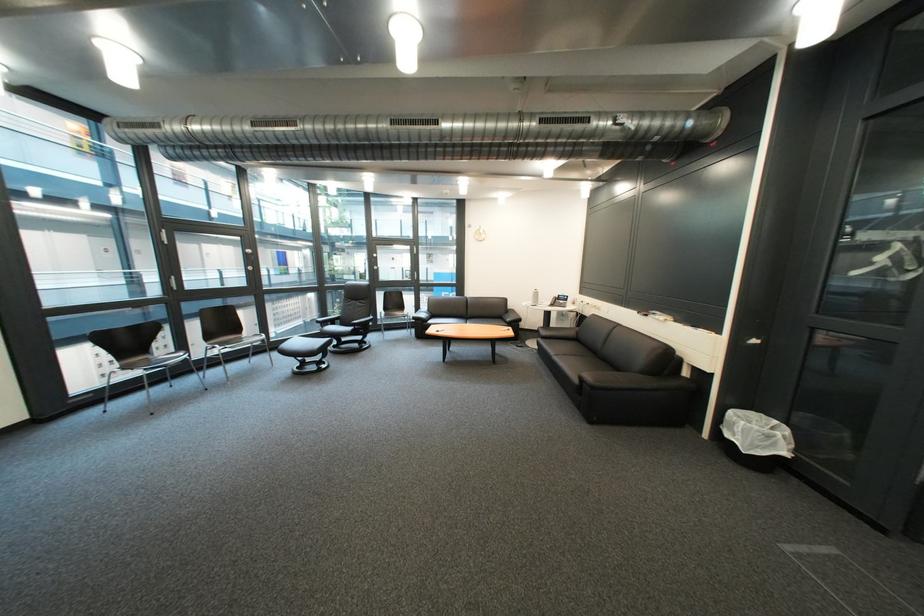
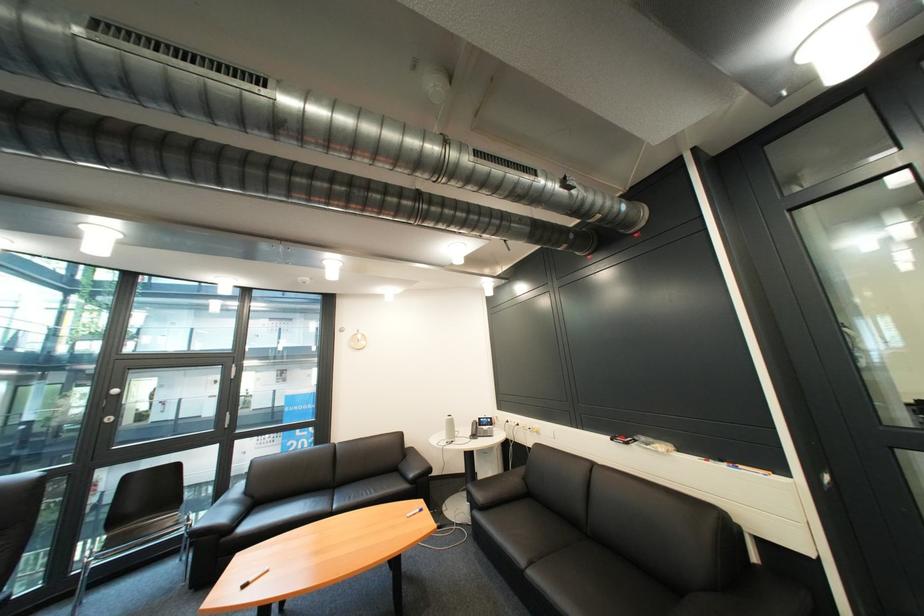
Locate, in the second image, the point that corresponds to pixel 386 262 in the first image.

(118, 408)